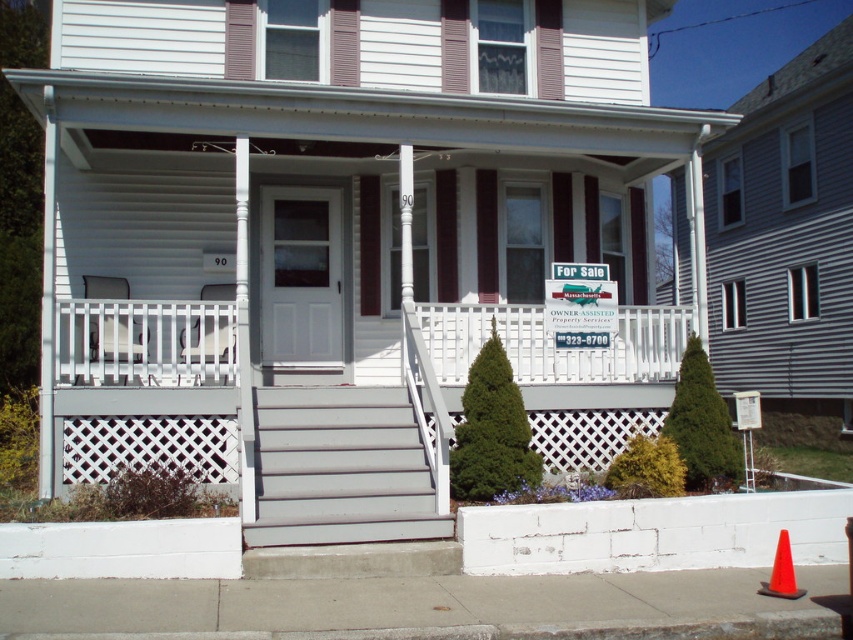
Who is more forward, (x=387, y=445) or (x=590, y=337)?

Point (x=387, y=445)

I want to click on gray painted wood stairs at center, so click(x=340, y=468).

Between point (428, 531) and point (579, 268), which one is positioned behind?

Point (579, 268)

The image size is (853, 640). Identify the location of gray painted wood stairs at center. (340, 468).

Who is more distant from viewer, (398, 448) or (779, 548)?

The point (398, 448) is behind.

Does gray painted wood stairs at center appear on the left side of orange plastic traffic cone at lower right?

Yes, gray painted wood stairs at center is to the left of orange plastic traffic cone at lower right.

Find the location of a particular element. The width and height of the screenshot is (853, 640). gray painted wood stairs at center is located at coordinates (340, 468).

Identify the location of gray painted wood stairs at center. (340, 468).

Is white painted wood porch at center above orange plastic traffic cone at lower right?

Yes.

Is point (463, 356) positioned before point (793, 589)?

That is False.

Looking at this image, who is more forward, (657, 346) or (787, 580)?

Point (787, 580) is more forward.

Find the location of a particular element. The image size is (853, 640). white painted wood porch at center is located at coordinates (553, 342).